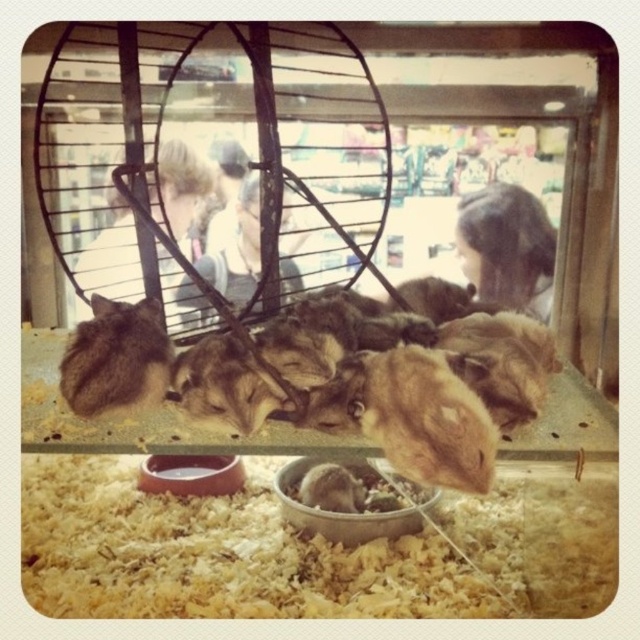
You are a customer looking at the hamsters through the enclosure glass. You notice the brown fluffy hamster at center and the fuzzy brown fur at lower left. Which hamster is positioned more to the right side of the enclosure?

The brown fluffy hamster at center is positioned more to the right side of the enclosure compared to the fuzzy brown fur at lower left.

You are a customer at the pet store looking through the enclosure. You notice the brown fluffy hamster at center and the fuzzy brown fur at lower left. Which hamster is positioned closer to you?

The brown fluffy hamster at center is closer to the viewer than the fuzzy brown fur at lower left.